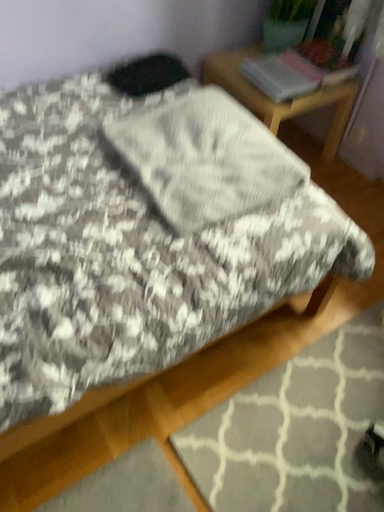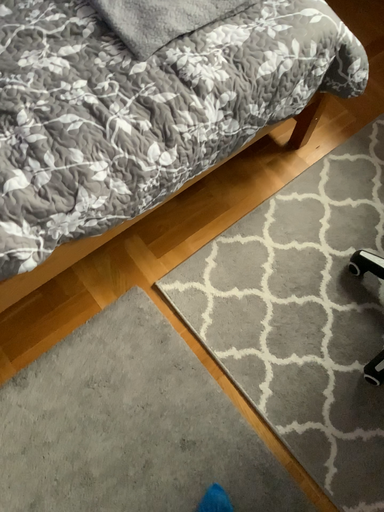
Question: Which way did the camera rotate in the video?

Choices:
 (A) rotated downward
 (B) rotated upward

Answer: (A)